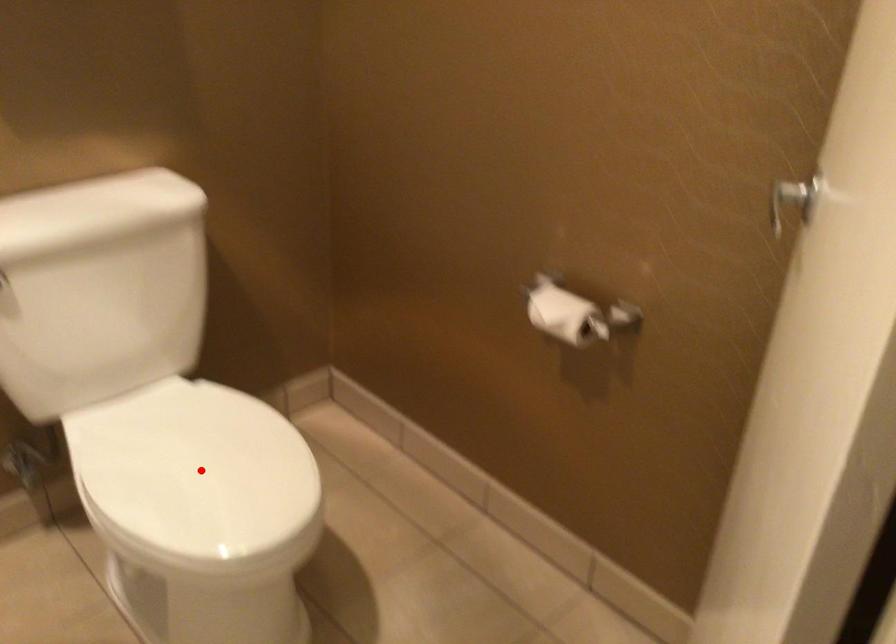
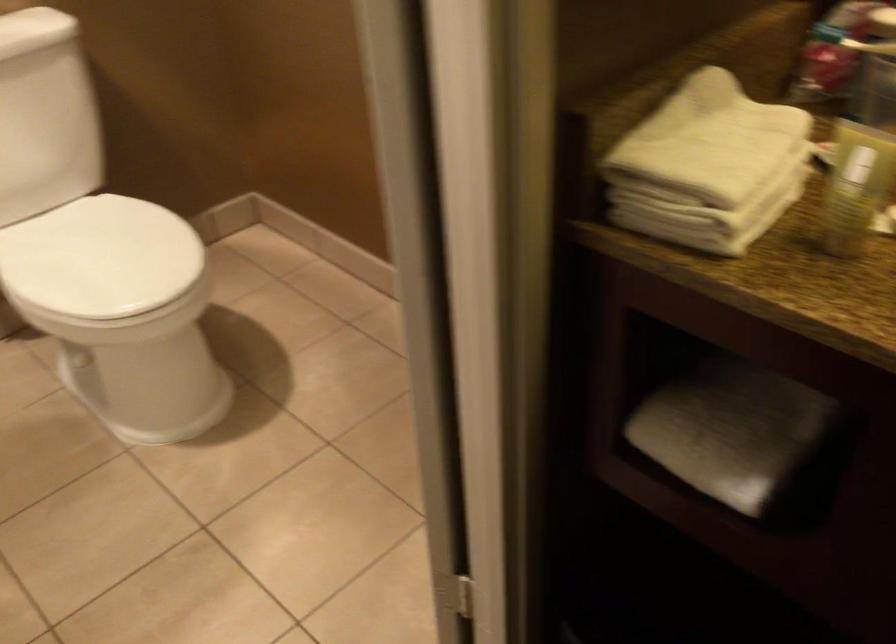
The point at the highlighted location is marked in the first image. Where is the corresponding point in the second image?

(99, 257)